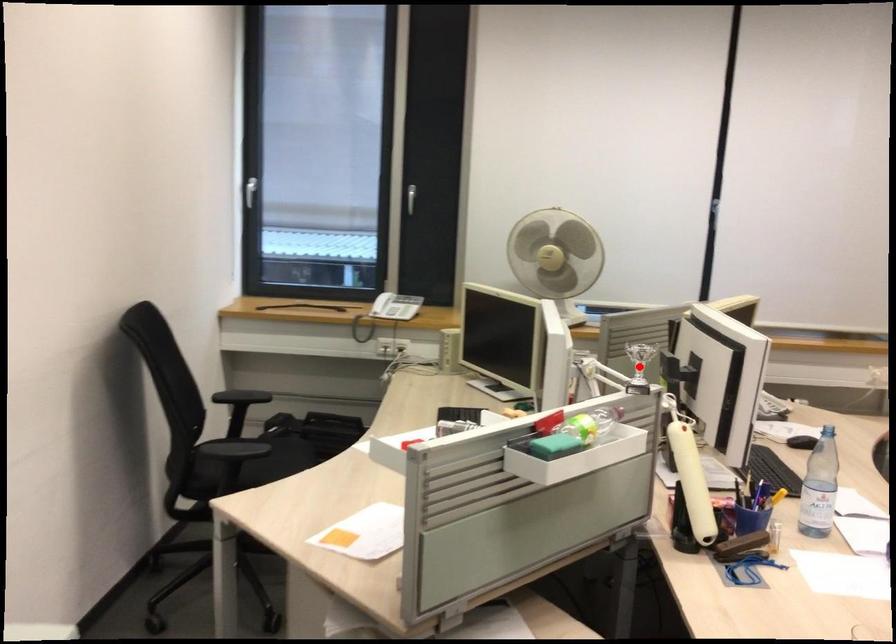
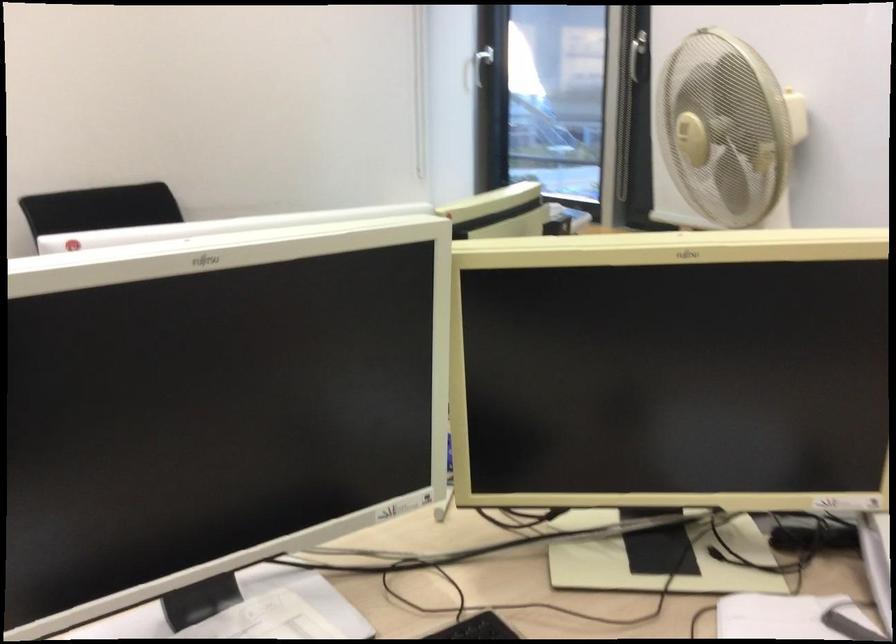
Question: I am providing you with two images of the same scene from different viewpoints. A red point is marked on the first image. Can you still see the location of the red point in image 2?

Choices:
 (A) Yes
 (B) No

Answer: (B)